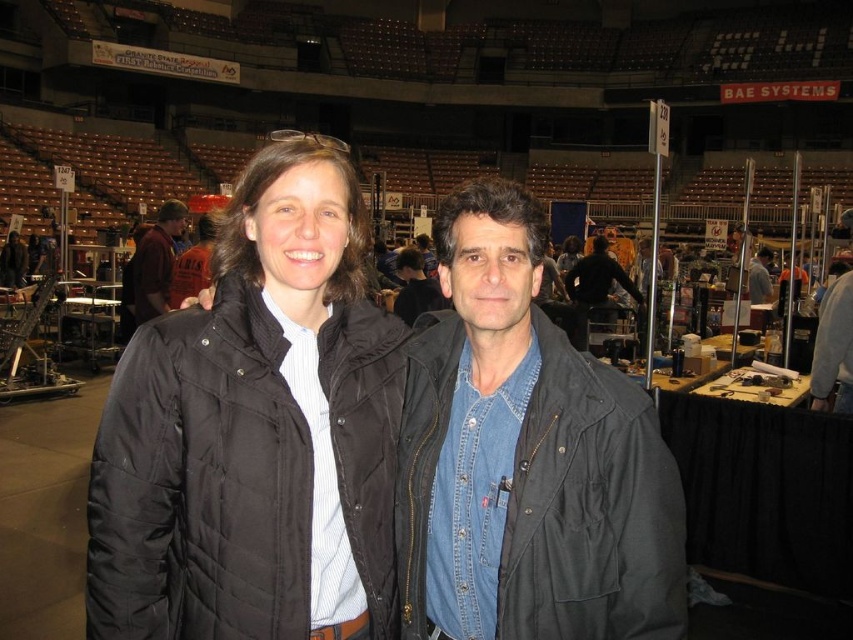
In the scene shown: You are standing at the point with coordinates point (256, 432). What object is located at that position?

The point (256, 432) corresponds to the black quilted jacket at center.

You are a photographer at the event and need to capture a photo of both the denim shirt at center and the dark brown leather jacket at left. Which one should you focus on first to ensure both are in the frame?

You should focus on the dark brown leather jacket at left first because the denim shirt at center is in front of it, ensuring both will be in the frame when starting from the back.

You are an event organizer trying to seat two volunteers in the front row. You have two jackets to place on the seats. The black quilted jacket at center is for the first seat and the dark brown leather jacket at left is for the second seat. Considering their sizes, which jacket requires a wider seat?

The black quilted jacket at center requires a wider seat because its width is larger than the dark brown leather jacket at left.